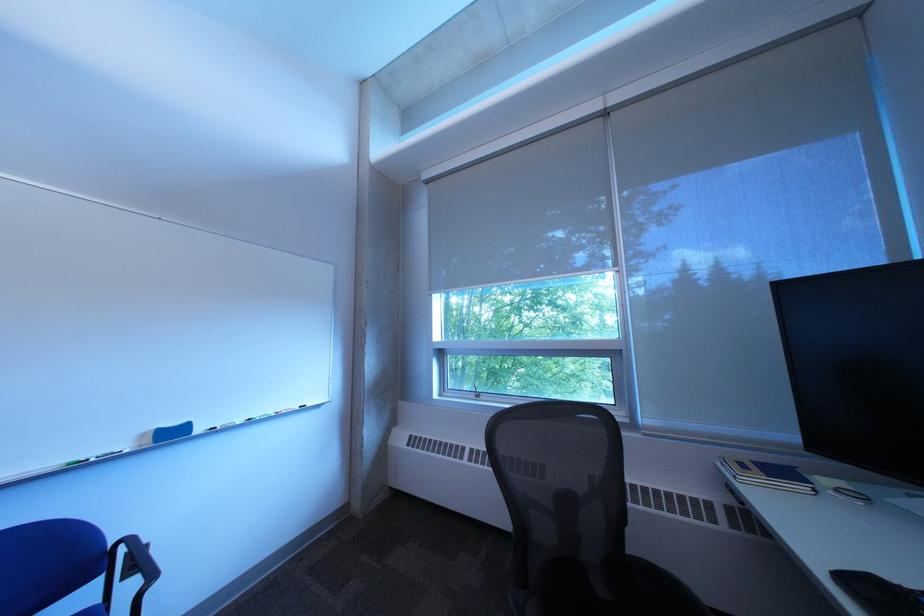
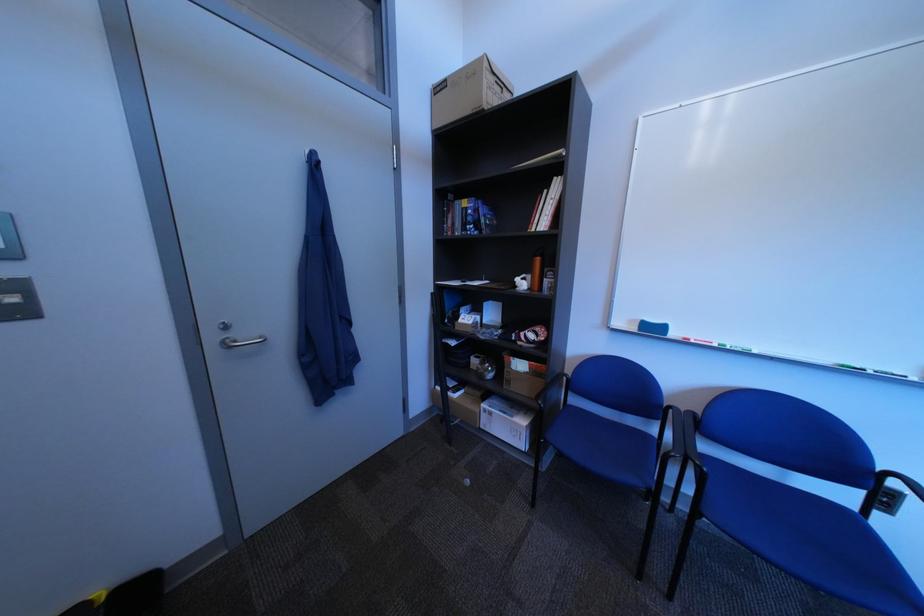
Find the pixel in the second image that matches (x=117, y=578) in the first image.

(881, 493)